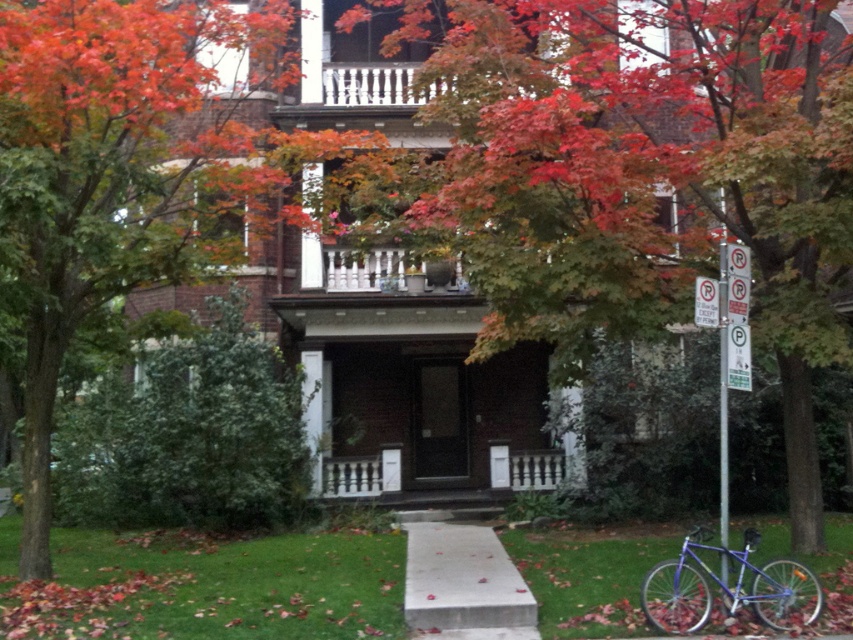
You are standing at the front door of the house and want to walk to the point labeled point (753, 156). Which direction should you go relative to the point labeled point (15, 211)?

Since point (753, 156) is behind point (15, 211), you should walk in the direction away from point (15, 211) to reach point (753, 156).

You are a visitor arriving at the house and notice the shiny blue bicycle at lower right and the white wooden porch at center. Which object appears bigger in the image?

The shiny blue bicycle at lower right appears bigger in the image because it is larger in size than the white wooden porch at center.